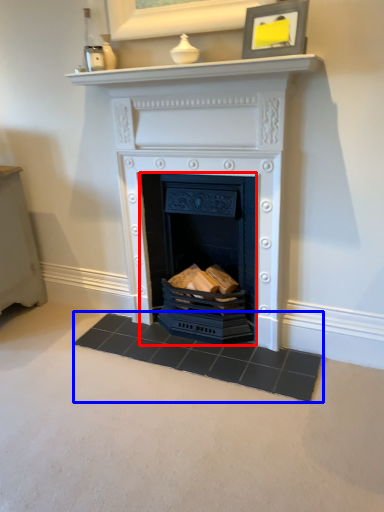
Question: Which object is further to the camera taking this photo, fireplace (highlighted by a red box) or doormat (highlighted by a blue box)?

Choices:
 (A) fireplace
 (B) doormat

Answer: (A)